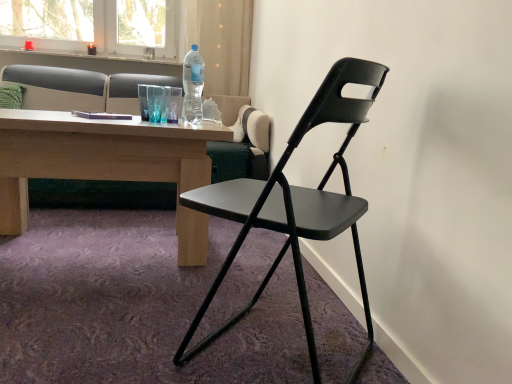
Question: From the image's perspective, is matte gray studio couch at upper left under transparent plastic bottle at upper center?

Choices:
 (A) yes
 (B) no

Answer: (A)

Question: Is the position of matte gray studio couch at upper left less distant than that of transparent plastic bottle at upper center?

Choices:
 (A) no
 (B) yes

Answer: (A)

Question: Is transparent plastic bottle at upper center at the back of matte gray studio couch at upper left?

Choices:
 (A) no
 (B) yes

Answer: (A)

Question: Is transparent plastic bottle at upper center surrounded by matte gray studio couch at upper left?

Choices:
 (A) yes
 (B) no

Answer: (B)

Question: Is matte gray studio couch at upper left at the left side of transparent plastic bottle at upper center?

Choices:
 (A) yes
 (B) no

Answer: (A)

Question: Is matte black folding chair at center wider or thinner than green fabric pillow at upper left?

Choices:
 (A) thin
 (B) wide

Answer: (B)

Question: Considering the positions of matte black folding chair at center and green fabric pillow at upper left in the image, is matte black folding chair at center bigger or smaller than green fabric pillow at upper left?

Choices:
 (A) big
 (B) small

Answer: (A)

Question: From a real-world perspective, is matte black folding chair at center physically located above or below green fabric pillow at upper left?

Choices:
 (A) below
 (B) above

Answer: (A)

Question: Is matte black folding chair at center in front of or behind green fabric pillow at upper left in the image?

Choices:
 (A) front
 (B) behind

Answer: (A)

Question: From their relative heights in the image, would you say transparent plastic bottle at upper center is taller or shorter than green fabric pillow at upper left?

Choices:
 (A) tall
 (B) short

Answer: (A)

Question: Is transparent plastic bottle at upper center wider or thinner than green fabric pillow at upper left?

Choices:
 (A) thin
 (B) wide

Answer: (A)

Question: Does point (196, 82) appear closer or farther from the camera than point (1, 104)?

Choices:
 (A) farther
 (B) closer

Answer: (B)

Question: Do you think transparent plastic bottle at upper center is within green fabric pillow at upper left, or outside of it?

Choices:
 (A) outside
 (B) inside

Answer: (A)

Question: In the image, is matte black folding chair at center positioned in front of or behind transparent plastic bottle at upper center?

Choices:
 (A) behind
 (B) front

Answer: (B)

Question: Would you say matte black folding chair at center is inside or outside transparent plastic bottle at upper center?

Choices:
 (A) outside
 (B) inside

Answer: (A)